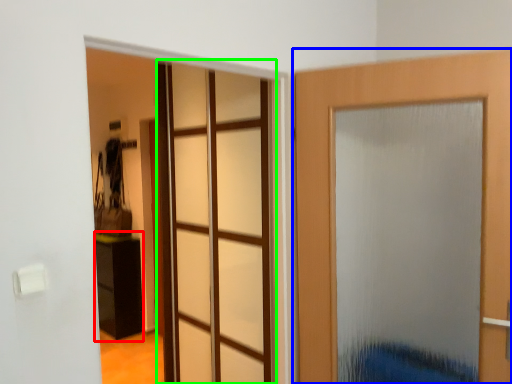
Question: Estimate the real-world distances between objects in this image. Which object is closer to furniture (highlighted by a red box), door (highlighted by a blue box) or glass door (highlighted by a green box)?

Choices:
 (A) door
 (B) glass door

Answer: (B)